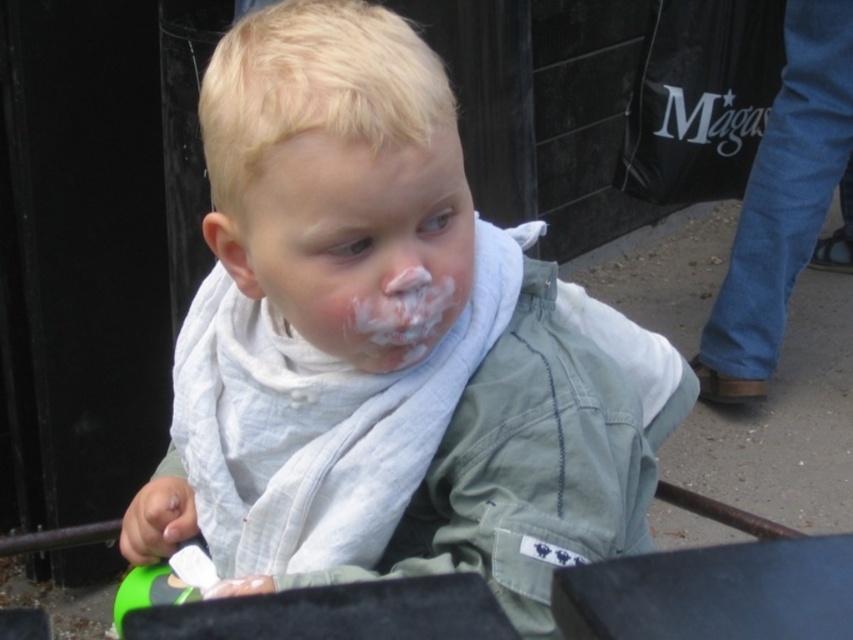
You are a photographer standing 10 feet away from the light green fabric shirt at center and the white creamy frosting at center. Can you capture both in a single photo without moving your camera? Explain why or why not.

The light green fabric shirt at center is 5.34 inches away from the white creamy frosting at center. Since the distance between them is only 5.34 inches and you are 10 feet away, both objects are within the camera frame and can be captured in a single photo without moving the camera.

You are a fashion designer observing the child in the scene. You need to determine if the light green fabric shirt at center can be paired with the white matte scarf at center based on their sizes. Can the shirt accommodate the scarf in terms of height?

The light green fabric shirt at center has a greater height compared to the white matte scarf at center, so yes, the shirt can accommodate the scarf in terms of height.